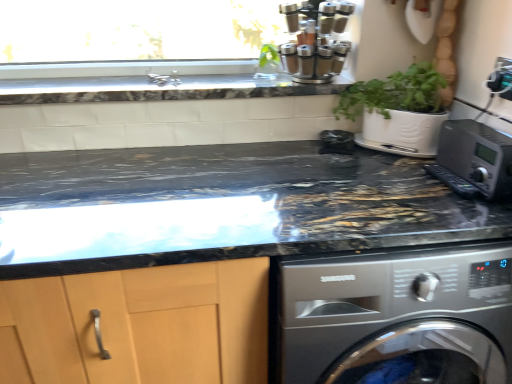
The width and height of the screenshot is (512, 384). Find the location of `vacant region to the left of metallic silver microwave at right`. vacant region to the left of metallic silver microwave at right is located at coordinates (404, 183).